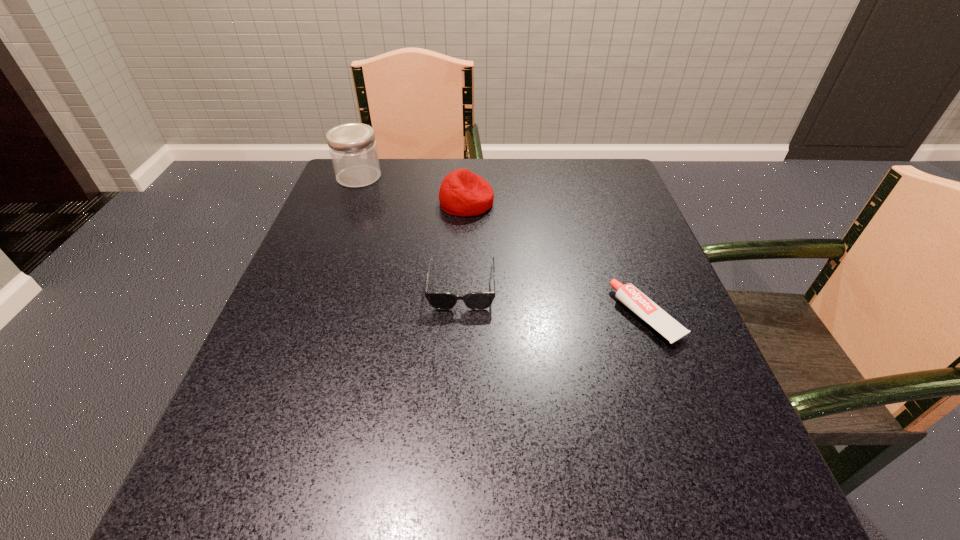
Identify the location of vacant point located between the tallest object and the toothpaste. The image size is (960, 540). (503, 247).

What are the coordinates of `the second closest object to the second shortest object` in the screenshot? It's located at (628, 294).

You are a GUI agent. You are given a task and a screenshot of the screen. Output one action in this format:
    pyautogui.click(x=<x>, y=<y>)
    Task: Click on the object that is the nearest to the beanbag
    This screenshot has height=540, width=960.
    Given the screenshot: What is the action you would take?
    click(x=439, y=300)

Find the location of `free space that satisfies the following two spatial constraints: 1. at the front lenses of the sunglasses; 2. on the right side of the rightmost object`. free space that satisfies the following two spatial constraints: 1. at the front lenses of the sunglasses; 2. on the right side of the rightmost object is located at coordinates (461, 316).

The width and height of the screenshot is (960, 540). In order to click on vacant space that satisfies the following two spatial constraints: 1. on the seat area of the beanbag; 2. on the left side of the toothpaste in this screenshot , I will do click(x=462, y=316).

I want to click on vacant space that satisfies the following two spatial constraints: 1. at the front lenses of the third tallest object; 2. on the right side of the shortest object, so click(x=461, y=316).

This screenshot has height=540, width=960. I want to click on vacant space that satisfies the following two spatial constraints: 1. on the seat area of the shortest object; 2. on the left side of the beanbag, so click(462, 316).

At what (x,y) coordinates should I click in order to perform the action: click on vacant area in the image that satisfies the following two spatial constraints: 1. at the front lenses of the rightmost object; 2. on the left side of the second shortest object. Please return your answer as a coordinate pair (x, y). Looking at the image, I should click on (461, 316).

Identify the location of free location that satisfies the following two spatial constraints: 1. on the seat area of the second tallest object; 2. at the front lenses of the third tallest object. (463, 285).

Image resolution: width=960 pixels, height=540 pixels. Find the location of `vacant area in the image that satisfies the following two spatial constraints: 1. on the back side of the toothpaste; 2. on the seat area of the beanbag`. vacant area in the image that satisfies the following two spatial constraints: 1. on the back side of the toothpaste; 2. on the seat area of the beanbag is located at coordinates (605, 202).